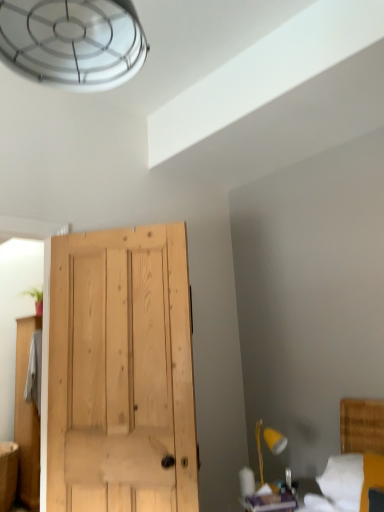
Question: Does yellow wood lamp at lower right have a smaller size compared to matte wood vanity at lower left?

Choices:
 (A) yes
 (B) no

Answer: (A)

Question: Considering the relative positions of yellow wood lamp at lower right and matte wood vanity at lower left in the image provided, is yellow wood lamp at lower right to the right of matte wood vanity at lower left from the viewer's perspective?

Choices:
 (A) no
 (B) yes

Answer: (B)

Question: Does yellow wood lamp at lower right appear on the left side of matte wood vanity at lower left?

Choices:
 (A) no
 (B) yes

Answer: (A)

Question: Is yellow wood lamp at lower right thinner than matte wood vanity at lower left?

Choices:
 (A) yes
 (B) no

Answer: (A)

Question: From the image's perspective, is yellow wood lamp at lower right above matte wood vanity at lower left?

Choices:
 (A) no
 (B) yes

Answer: (B)

Question: Is yellow wood lamp at lower right oriented towards matte wood vanity at lower left?

Choices:
 (A) no
 (B) yes

Answer: (A)

Question: From the image's perspective, would you say matte wood vanity at lower left is shown under yellow wood lamp at lower right?

Choices:
 (A) no
 (B) yes

Answer: (B)

Question: From a real-world perspective, is matte wood vanity at lower left physically above yellow wood lamp at lower right?

Choices:
 (A) no
 (B) yes

Answer: (A)

Question: Does matte wood vanity at lower left lie in front of yellow wood lamp at lower right?

Choices:
 (A) yes
 (B) no

Answer: (B)

Question: Is yellow wood lamp at lower right at the back of matte wood vanity at lower left?

Choices:
 (A) no
 (B) yes

Answer: (A)

Question: Can you confirm if matte wood vanity at lower left is thinner than yellow wood lamp at lower right?

Choices:
 (A) no
 (B) yes

Answer: (A)

Question: Is matte wood vanity at lower left touching yellow wood lamp at lower right?

Choices:
 (A) no
 (B) yes

Answer: (A)

Question: Does yellow wood lamp at lower right contain white fabric bed at lower right?

Choices:
 (A) no
 (B) yes

Answer: (A)